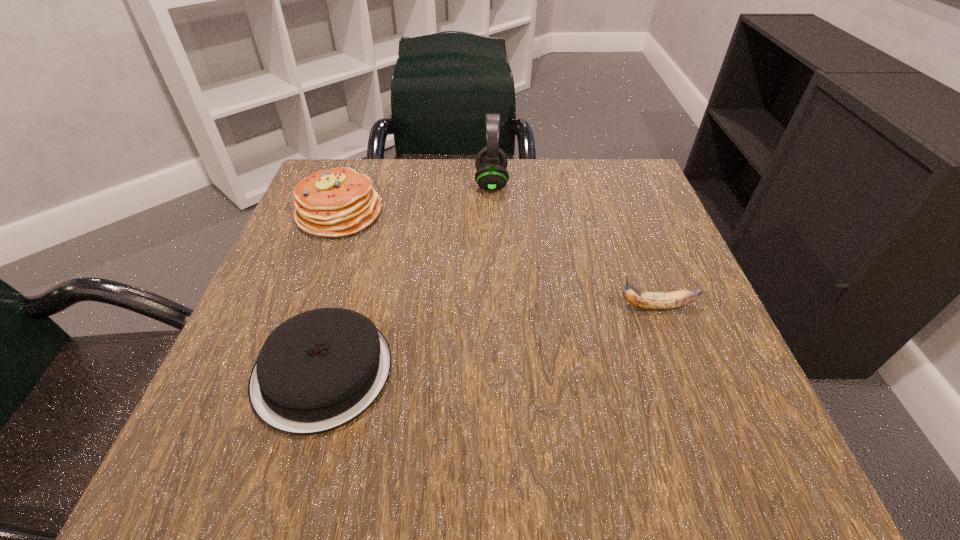
You are a GUI agent. You are given a task and a screenshot of the screen. Output one action in this format:
    pyautogui.click(x=<x>, y=<y>)
    Task: Click on the headset
    
    Given the screenshot: What is the action you would take?
    pyautogui.click(x=491, y=162)

Locate an element on the screen. the tallest object is located at coordinates (491, 162).

Locate an element on the screen. The width and height of the screenshot is (960, 540). the taller pancake is located at coordinates (338, 202).

At what (x,y) coordinates should I click in order to perform the action: click on the second tallest object. Please return your answer as a coordinate pair (x, y). The image size is (960, 540). Looking at the image, I should click on (338, 202).

Identify the location of the second nearest object. Image resolution: width=960 pixels, height=540 pixels. (645, 300).

This screenshot has width=960, height=540. Identify the location of the third tallest object. (645, 300).

You are a GUI agent. You are given a task and a screenshot of the screen. Output one action in this format:
    pyautogui.click(x=<x>, y=<y>)
    Task: Click on the nearest object
    The height and width of the screenshot is (540, 960).
    Given the screenshot: What is the action you would take?
    319,370

Find the location of a particular element. the shorter pancake is located at coordinates (319, 370).

Identify the location of free space located on the ear cups of the tallest object. (388, 183).

Find the location of a particular element. This screenshot has height=540, width=960. free point located on the ear cups of the tallest object is located at coordinates point(444,183).